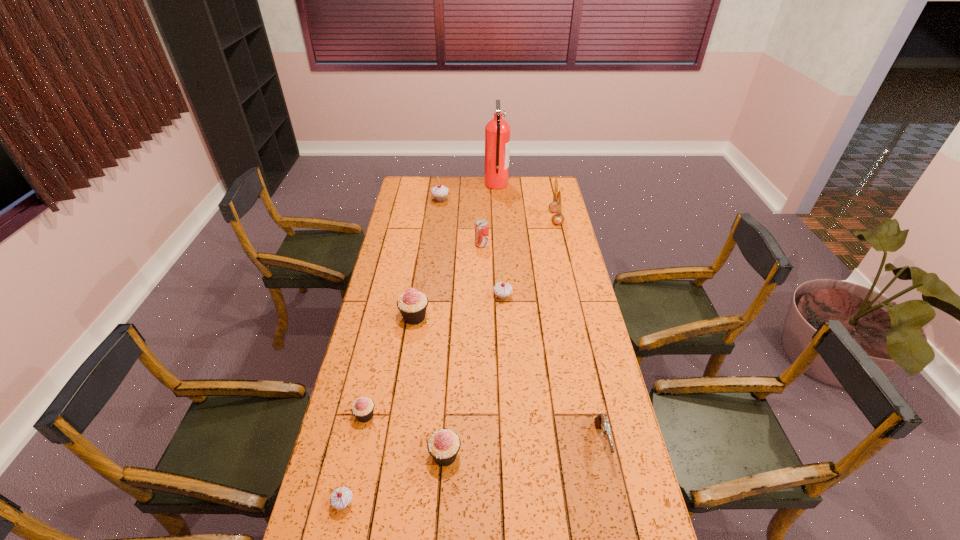
At what (x,y) coordinates should I click in order to perform the action: click on vacant space that satisfies the following two spatial constraints: 1. on the front-facing side of the earphone; 2. on the front side of the pink soda can. Please return your answer as a coordinate pair (x, y). This screenshot has height=540, width=960. Looking at the image, I should click on (562, 244).